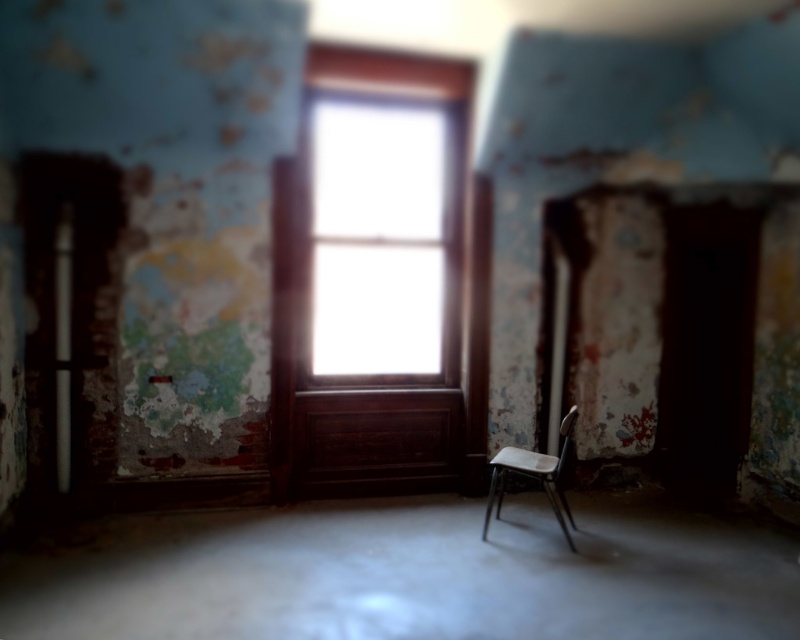
Question: Does transparent glass window at center appear on the right side of metallic gray chair at center?

Choices:
 (A) yes
 (B) no

Answer: (B)

Question: Among these objects, which one is nearest to the camera?

Choices:
 (A) transparent glass window at center
 (B) metallic gray chair at center

Answer: (B)

Question: Where is transparent glass window at center located in relation to metallic gray chair at center in the image?

Choices:
 (A) right
 (B) left

Answer: (B)

Question: Does transparent glass window at center appear over metallic gray chair at center?

Choices:
 (A) no
 (B) yes

Answer: (B)

Question: Which of the following is the farthest from the observer?

Choices:
 (A) (328, 307)
 (B) (505, 472)

Answer: (A)